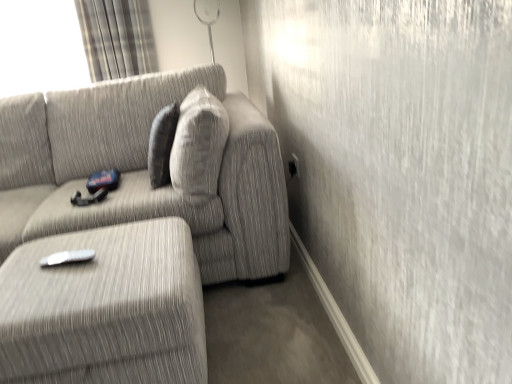
Identify the location of vacant region in front of white plastic remote at lower left. (54, 290).